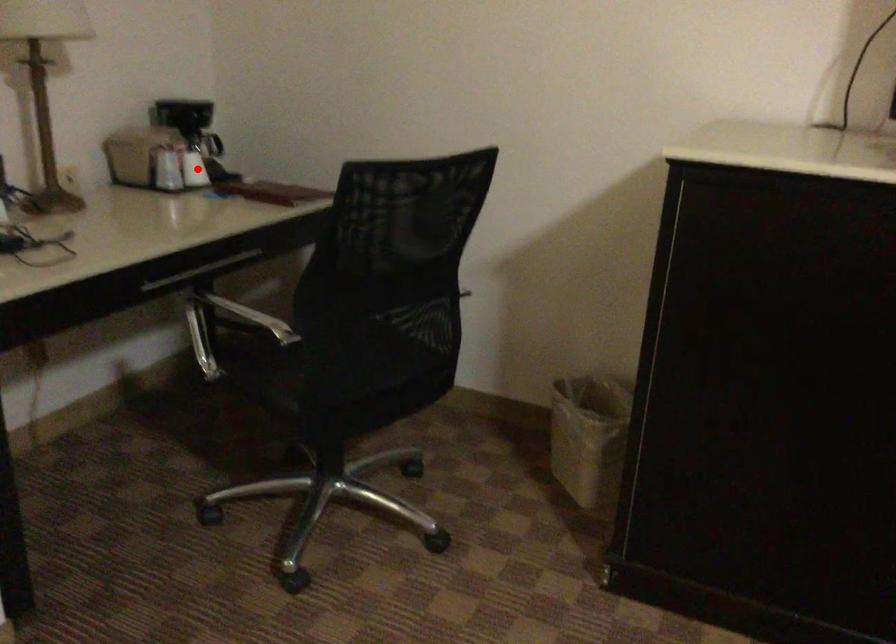
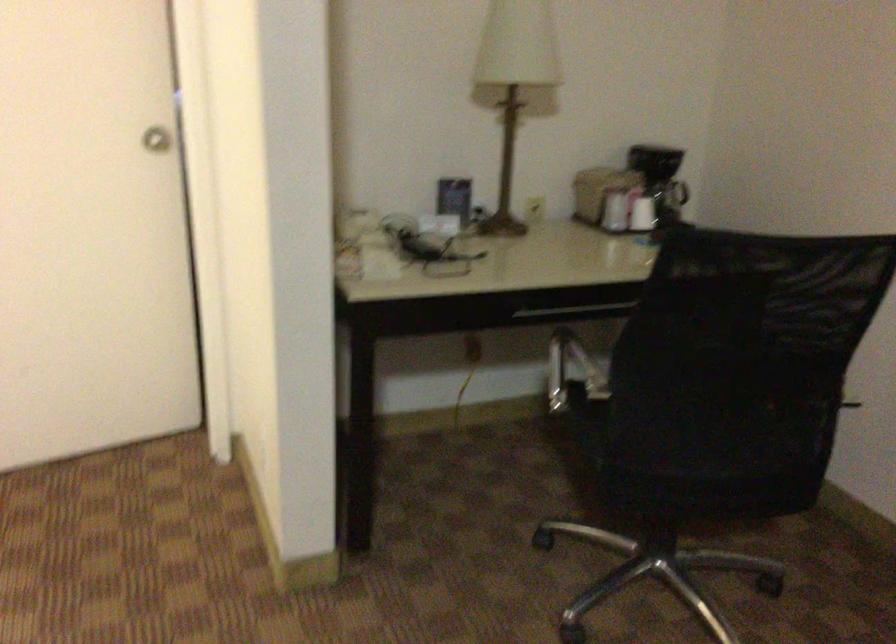
Find the pixel in the second image that matches the highlighted location in the first image.

(642, 214)